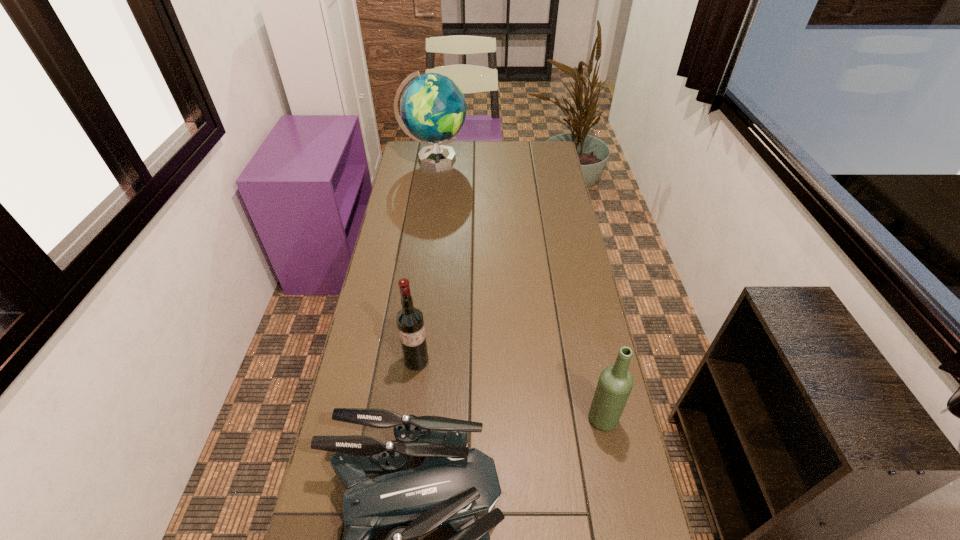
What are the coordinates of `globe that is at the left edge` in the screenshot? It's located at (433, 109).

At what (x,y) coordinates should I click in order to perform the action: click on wine bottle at the left edge. Please return your answer as a coordinate pair (x, y). Looking at the image, I should click on (410, 323).

At what (x,y) coordinates should I click in order to perform the action: click on object that is at the right edge. Please return your answer as a coordinate pair (x, y). This screenshot has height=540, width=960. Looking at the image, I should click on (615, 383).

Where is `object positioned at the far left corner`? This screenshot has height=540, width=960. object positioned at the far left corner is located at coordinates (433, 109).

Where is `free region at the left edge`? The height and width of the screenshot is (540, 960). free region at the left edge is located at coordinates (406, 181).

Find the location of `free region at the right edge of the desktop`. free region at the right edge of the desktop is located at coordinates (582, 261).

Where is `vacant space at the far left corner`? This screenshot has height=540, width=960. vacant space at the far left corner is located at coordinates pos(420,146).

The height and width of the screenshot is (540, 960). What are the coordinates of `free space between the farther wine bottle and the rightmost object` in the screenshot? It's located at (510, 390).

Find the location of a particular element. This screenshot has height=540, width=960. free space between the left wine bottle and the nearer wine bottle is located at coordinates (510, 390).

The image size is (960, 540). I want to click on free space between the left wine bottle and the nearer wine bottle, so click(x=510, y=390).